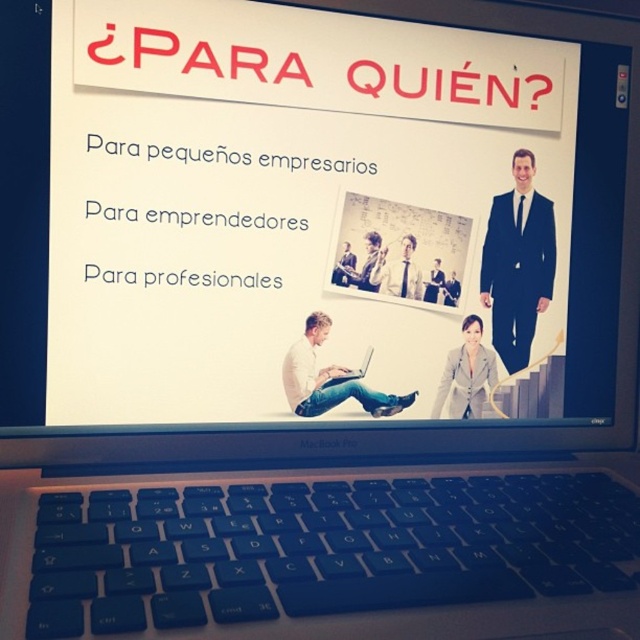
Question: In this image, where is blue plastic keyboard at lower center located relative to white matte laptop at center?

Choices:
 (A) left
 (B) right

Answer: (B)

Question: Among these objects, which one is farthest from the camera?

Choices:
 (A) white matte laptop at center
 (B) silver metallic laptop at center
 (C) blue plastic keyboard at lower center

Answer: (B)

Question: In this image, where is blue plastic keyboard at lower center located relative to silver metallic laptop at center?

Choices:
 (A) above
 (B) below

Answer: (B)

Question: Which point is closer to the camera?

Choices:
 (A) (326, 320)
 (B) (328, 378)
 (C) (336, 596)

Answer: (C)

Question: Considering the real-world distances, which object is closest to the silver metallic laptop at center?

Choices:
 (A) white matte laptop at center
 (B) blue plastic keyboard at lower center

Answer: (A)

Question: Can you confirm if blue plastic keyboard at lower center is positioned below white matte laptop at center?

Choices:
 (A) no
 (B) yes

Answer: (B)